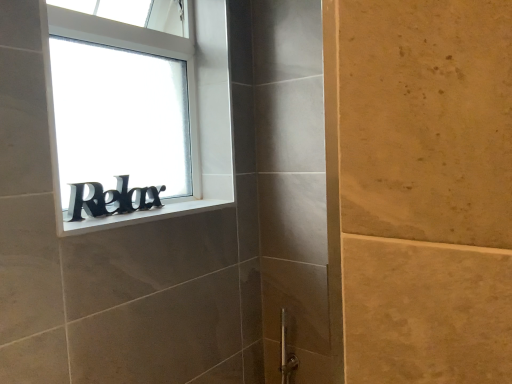
Question: Considering the relative sizes of white matte window sill at upper left and black matte sign at upper left in the image provided, is white matte window sill at upper left wider than black matte sign at upper left?

Choices:
 (A) yes
 (B) no

Answer: (A)

Question: Considering the relative sizes of white matte window sill at upper left and black matte sign at upper left in the image provided, is white matte window sill at upper left bigger than black matte sign at upper left?

Choices:
 (A) yes
 (B) no

Answer: (B)

Question: Would you say white matte window sill at upper left is outside black matte sign at upper left?

Choices:
 (A) yes
 (B) no

Answer: (A)

Question: Does white matte window sill at upper left have a greater height compared to black matte sign at upper left?

Choices:
 (A) no
 (B) yes

Answer: (A)

Question: Can you confirm if white matte window sill at upper left is shorter than black matte sign at upper left?

Choices:
 (A) no
 (B) yes

Answer: (B)

Question: In terms of height, does black matte sign at upper left look taller or shorter compared to white matte window sill at upper left?

Choices:
 (A) short
 (B) tall

Answer: (B)

Question: Does point (105, 79) appear closer or farther from the camera than point (101, 223)?

Choices:
 (A) closer
 (B) farther

Answer: (B)

Question: Relative to white matte window sill at upper left, is black matte sign at upper left in front or behind?

Choices:
 (A) front
 (B) behind

Answer: (B)

Question: Is black matte sign at upper left bigger or smaller than white matte window sill at upper left?

Choices:
 (A) big
 (B) small

Answer: (A)

Question: Is black matte sign at window wider or thinner than black matte sign at upper left?

Choices:
 (A) thin
 (B) wide

Answer: (A)

Question: Considering their positions, is black matte sign at window located in front of or behind black matte sign at upper left?

Choices:
 (A) behind
 (B) front

Answer: (A)

Question: Is point (155, 190) positioned closer to the camera than point (224, 168)?

Choices:
 (A) farther
 (B) closer

Answer: (B)

Question: Looking at the image, does black matte sign at window seem bigger or smaller compared to black matte sign at upper left?

Choices:
 (A) big
 (B) small

Answer: (B)

Question: From a real-world perspective, is white matte window sill at upper left above or below black matte sign at upper left?

Choices:
 (A) below
 (B) above

Answer: (A)

Question: Considering their positions, is white matte window sill at upper left located in front of or behind black matte sign at upper left?

Choices:
 (A) behind
 (B) front

Answer: (B)